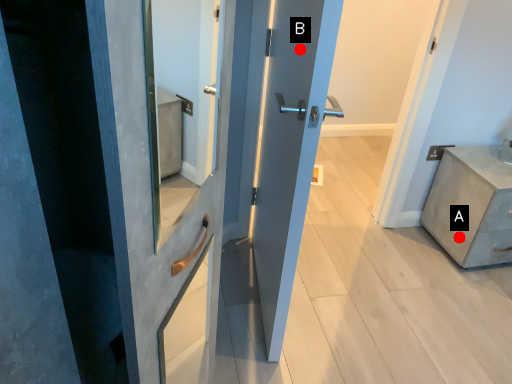
Question: Two points are circled on the image, labeled by A and B beside each circle. Which point is closer to the camera?

Choices:
 (A) A is closer
 (B) B is closer

Answer: (B)